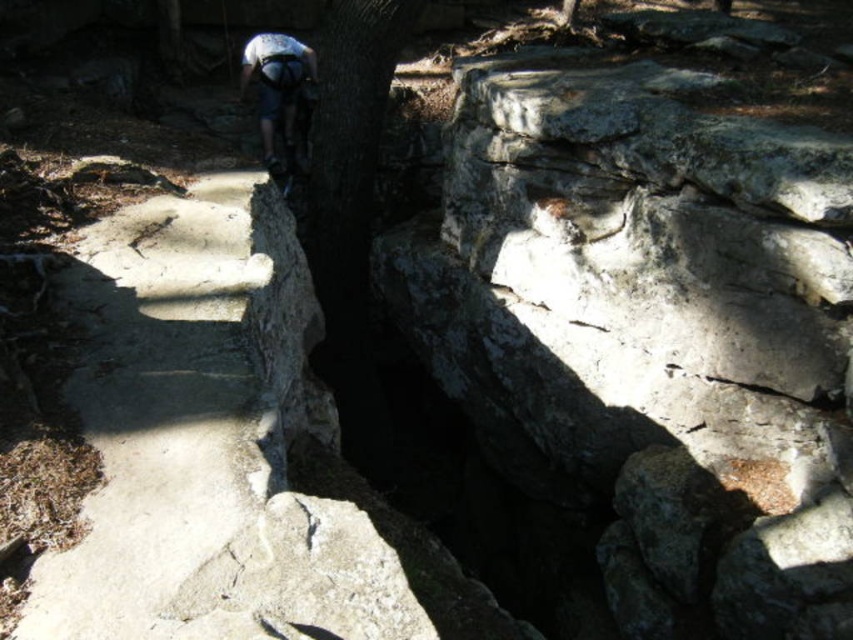
Question: Can you confirm if white concrete steps at center is positioned to the left of white matte helmet at upper center?

Choices:
 (A) no
 (B) yes

Answer: (A)

Question: Does white concrete steps at center come behind white matte helmet at upper center?

Choices:
 (A) no
 (B) yes

Answer: (A)

Question: Is white concrete steps at center bigger than white matte helmet at upper center?

Choices:
 (A) yes
 (B) no

Answer: (A)

Question: Which point appears farthest from the camera in this image?

Choices:
 (A) (73, 275)
 (B) (265, 68)

Answer: (B)